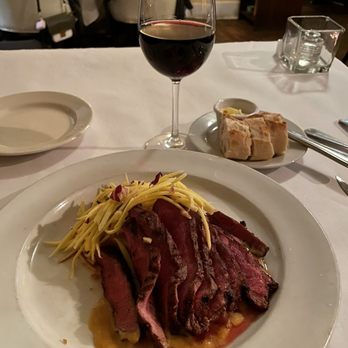
Where is `bread plate`? The image size is (348, 348). bread plate is located at coordinates (291, 156).